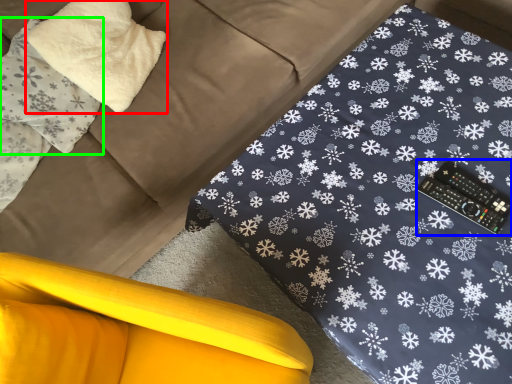
Question: Considering the real-world distances, which object is closest to pillow (highlighted by a red box)? control (highlighted by a blue box) or pillow (highlighted by a green box).

Choices:
 (A) control
 (B) pillow

Answer: (B)